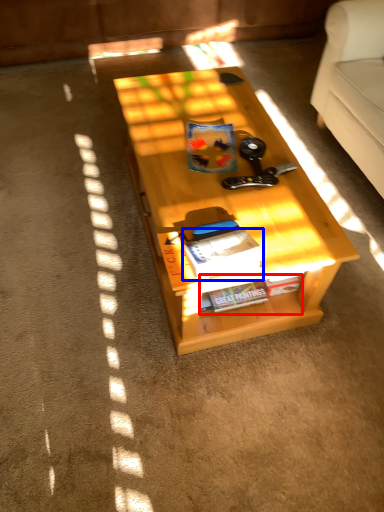
Question: Which object appears farthest to the camera in this image, book (highlighted by a red box) or magazine (highlighted by a blue box)?

Choices:
 (A) book
 (B) magazine

Answer: (A)